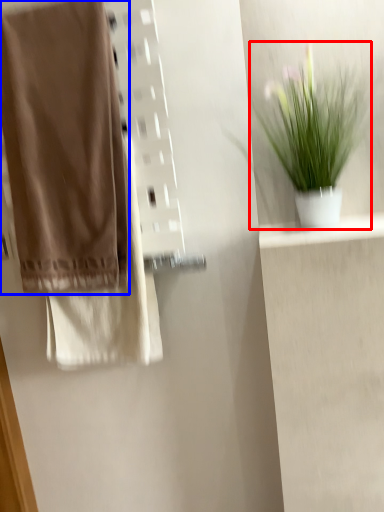
Question: Among these objects, which one is farthest to the camera, houseplant (highlighted by a red box) or towel (highlighted by a blue box)?

Choices:
 (A) houseplant
 (B) towel

Answer: (B)